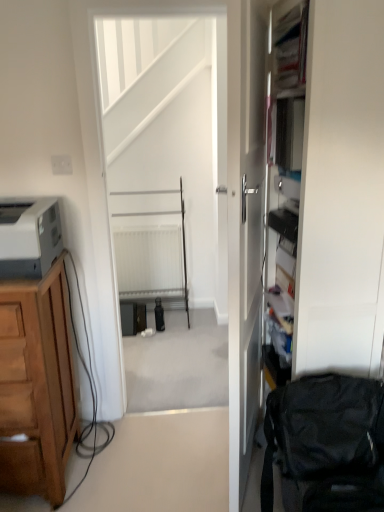
Question: Based on their sizes in the image, would you say matte gray printer at left is bigger or smaller than white glossy door at center?

Choices:
 (A) big
 (B) small

Answer: (B)

Question: Considering the positions of matte gray printer at left and white glossy door at center in the image, is matte gray printer at left taller or shorter than white glossy door at center?

Choices:
 (A) tall
 (B) short

Answer: (B)

Question: Considering the real-world distances, which object is farthest from the brown wooden cabinet at left?

Choices:
 (A) black fabric swivel chair at lower right
 (B) matte gray printer at left
 (C) white plastic radiator at center
 (D) white glossy door at center
 (E) white plastic electric outlet at upper left

Answer: (C)

Question: Estimate the real-world distances between objects in this image. Which object is farther from the white matte screen door at center?

Choices:
 (A) white glossy door at center
 (B) matte gray printer at left
 (C) brown wooden cabinet at left
 (D) white plastic electric outlet at upper left
 (E) black fabric swivel chair at lower right

Answer: (E)